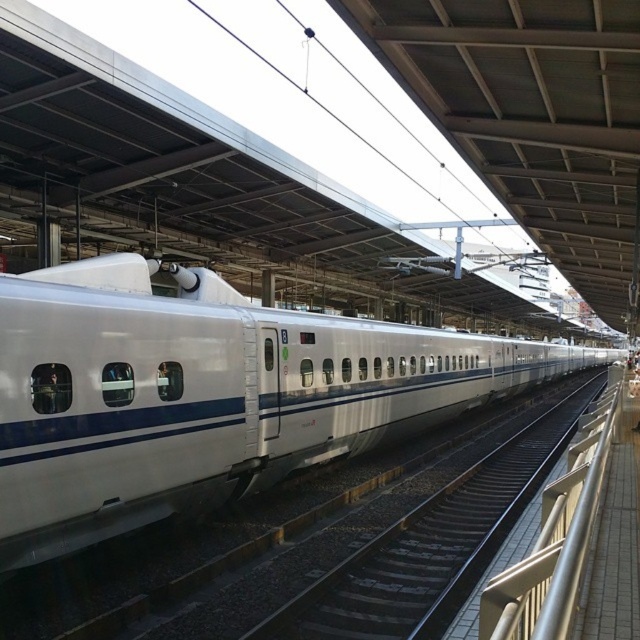
You are standing at the entrance of the train station and want to board the white glossy train at center. Based on its position, in which direction should you walk to reach it?

The white glossy train at center is located at point 0.619 on the x axis and 0.325 on the y axis. Since you are at the entrance, you should walk towards the center of the station where the train is positioned.

You are a maintenance worker who needs to access the white smooth train track at center for inspection. However, the white glossy train at center is currently blocking the path. Can you move around the train to reach the track without going around the entire train?

The white glossy train at center is in front of the white smooth train track at center, so you can move around the sides of the train to access the track behind it without needing to go all the way around the entire train.

You are a maintenance worker needing to place a 1.2 meter wide equipment on the platform. Which object, the white smooth train track at center or the silver metallic rail at right, would allow the equipment to fit without overlapping?

The silver metallic rail at right occupies more space than the white smooth train track at center, so placing the 1.2 meter wide equipment on the silver metallic rail at right would allow it to fit without overlapping.